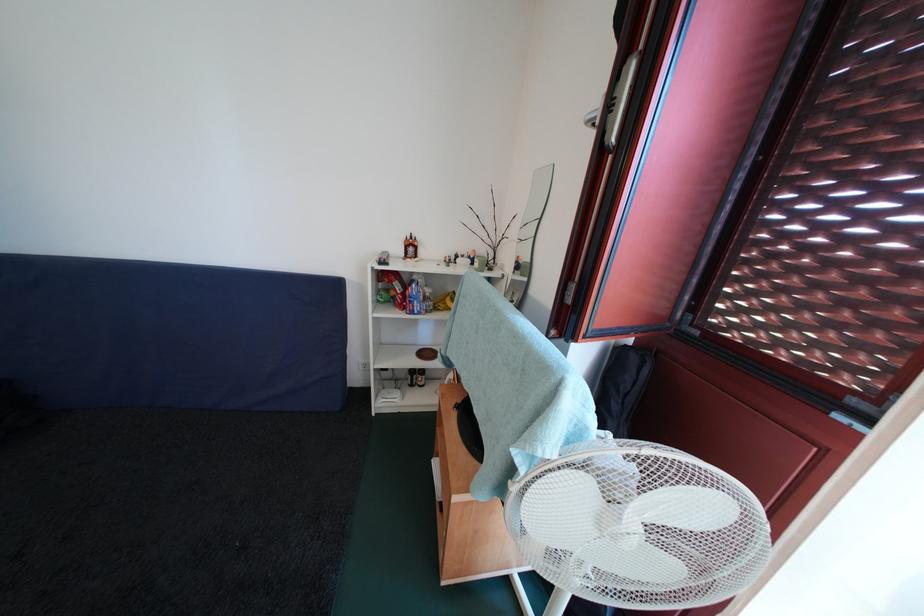
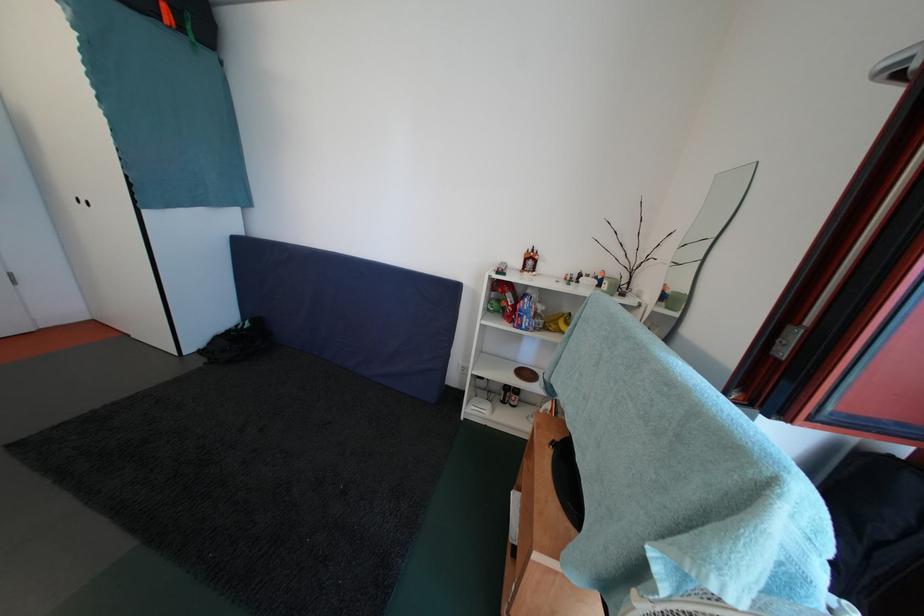
In a continuous first-person perspective shot, in which direction is the camera moving?

The cameraman walked toward left, forward.